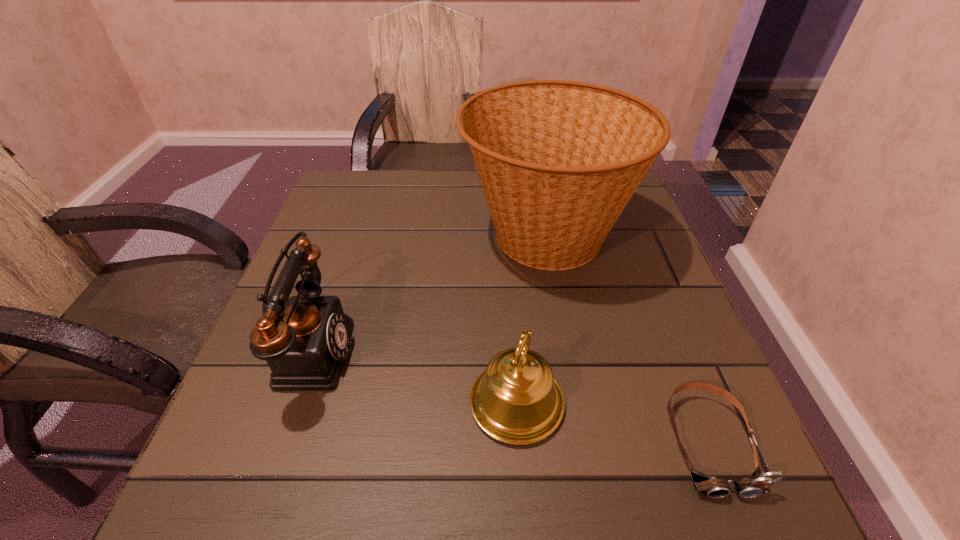
Image resolution: width=960 pixels, height=540 pixels. Identify the location of object that is at the left edge. (305, 347).

Where is `basket situated at the right edge`? Image resolution: width=960 pixels, height=540 pixels. basket situated at the right edge is located at coordinates (558, 160).

Where is `goggles located in the right edge section of the desktop`? goggles located in the right edge section of the desktop is located at coordinates (758, 483).

You are a GUI agent. You are given a task and a screenshot of the screen. Output one action in this format:
    pyautogui.click(x=<x>, y=<y>)
    Task: Click on the object that is positioned at the far right corner
    
    Given the screenshot: What is the action you would take?
    pyautogui.click(x=558, y=160)

Identify the location of object that is at the near right corner. (758, 483).

The image size is (960, 540). I want to click on blank space at the far edge, so click(x=396, y=178).

In the image, there is a desktop. In order to click on vacant space at the near edge in this screenshot , I will do `click(351, 469)`.

Where is `free space at the left edge of the desktop`? This screenshot has height=540, width=960. free space at the left edge of the desktop is located at coordinates pyautogui.click(x=353, y=246).

Identify the location of free region at the right edge of the desktop. This screenshot has width=960, height=540. (667, 287).

What are the coordinates of `free region at the far left corner of the desktop` in the screenshot? It's located at (345, 204).